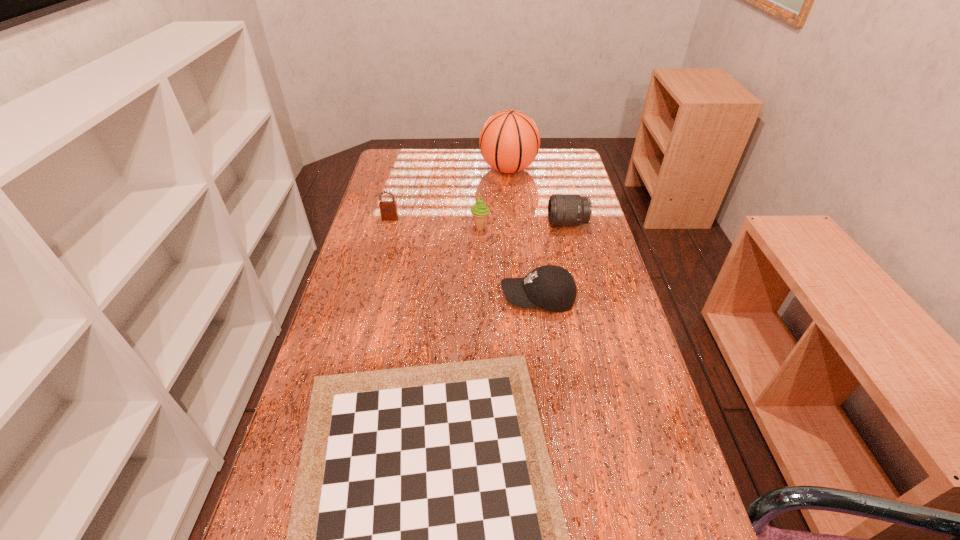
Locate an element on the screen. the tallest object is located at coordinates [509, 141].

At what (x,y) coordinates should I click in order to perform the action: click on the farthest object. Please return your answer as a coordinate pair (x, y). This screenshot has width=960, height=540. Looking at the image, I should click on (509, 141).

The width and height of the screenshot is (960, 540). In order to click on icecream in this screenshot , I will do `click(479, 210)`.

In order to click on padlock in this screenshot , I will do `click(388, 209)`.

The height and width of the screenshot is (540, 960). I want to click on telephoto lens, so click(x=563, y=209).

Identify the location of the fifth farthest object. Image resolution: width=960 pixels, height=540 pixels. (552, 288).

Where is `vacant space situated 0.080m on the front of the tallest object`? This screenshot has width=960, height=540. vacant space situated 0.080m on the front of the tallest object is located at coordinates (511, 197).

This screenshot has width=960, height=540. In order to click on vacant space situated on the front of the icecream in this screenshot , I will do `click(480, 249)`.

Identify the location of vacant space located on the front-facing side of the padlock. (382, 252).

At what (x,y) coordinates should I click in order to perform the action: click on vacant region located 0.140m on the surface of the telephoto lens. Please return your answer as a coordinate pair (x, y). Looking at the image, I should click on (505, 224).